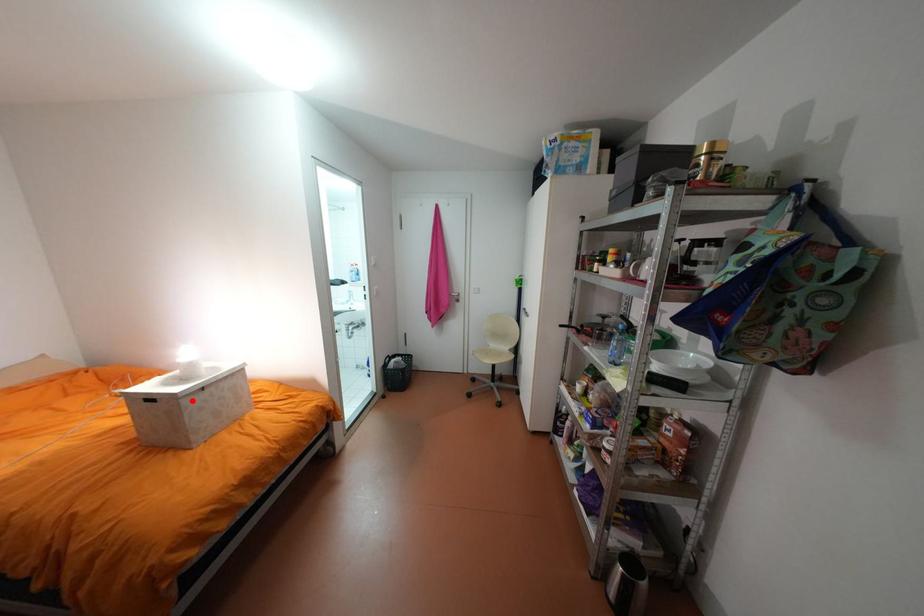
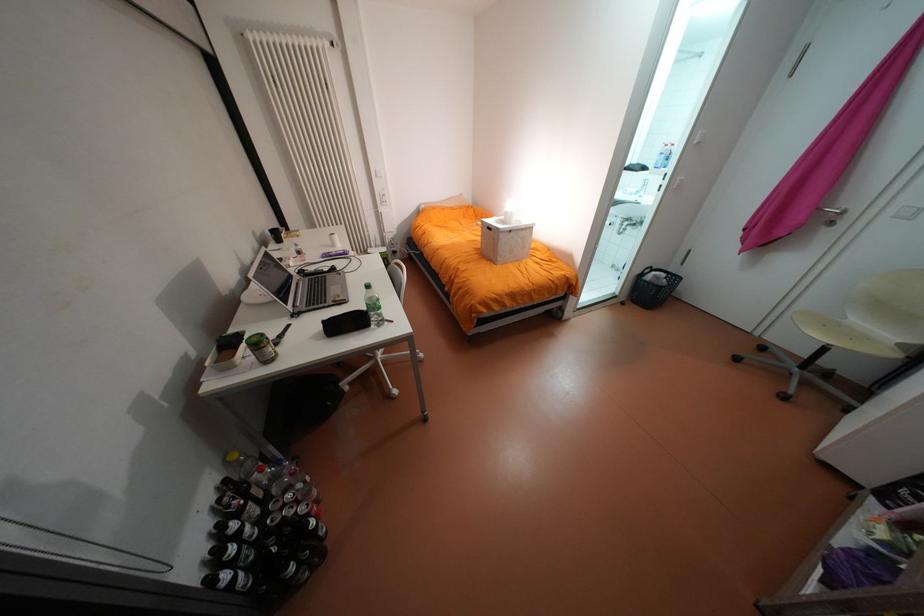
The point at the highlighted location is marked in the first image. Where is the corresponding point in the second image?

(509, 233)